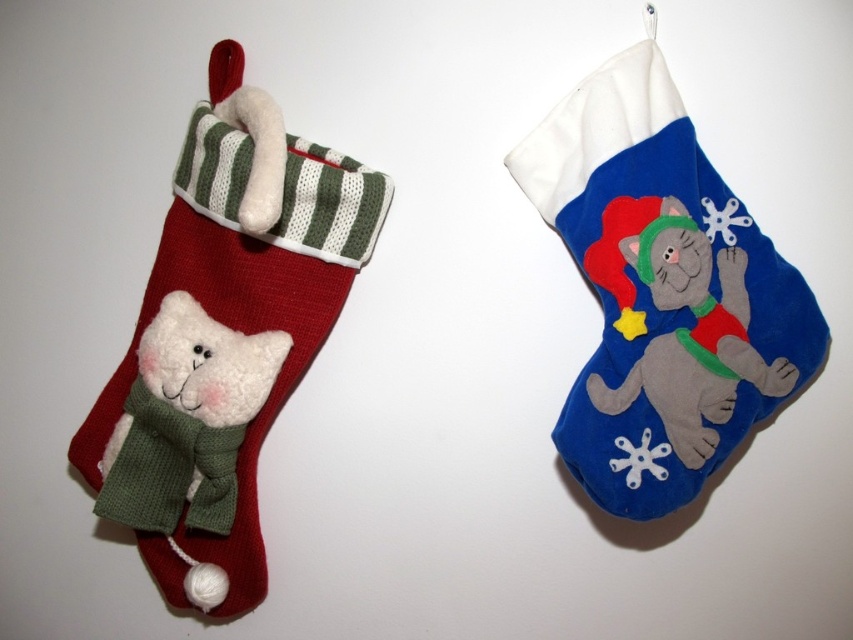
Question: Does knitted woolen cat at left appear over fuzzy gray cat at right?

Choices:
 (A) no
 (B) yes

Answer: (A)

Question: Estimate the real-world distances between objects in this image. Which object is closer to the knitted woolen cat at left?

Choices:
 (A) fuzzy gray cat at right
 (B) velvet blue stocking at upper right
 (C) white fluffy teddy at left

Answer: (C)

Question: Based on their relative distances, which object is nearer to the white fluffy teddy at left?

Choices:
 (A) velvet blue stocking at upper right
 (B) fuzzy gray cat at right
 (C) knitted woolen cat at left

Answer: (C)

Question: Is velvet blue stocking at upper right to the right of white fluffy teddy at left from the viewer's perspective?

Choices:
 (A) no
 (B) yes

Answer: (B)

Question: Which point is closer to the camera taking this photo?

Choices:
 (A) tap(711, 349)
 (B) tap(190, 244)
 (C) tap(790, 378)

Answer: (C)

Question: Can you confirm if white fluffy teddy at left is wider than fuzzy gray cat at right?

Choices:
 (A) yes
 (B) no

Answer: (B)